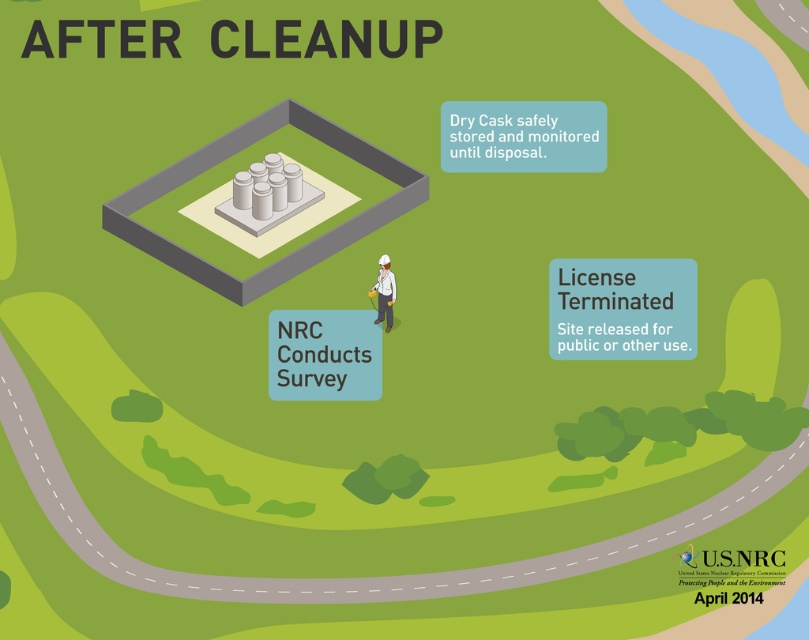
Can you confirm if matte gray cylinders at center is thinner than white hard hat at center?

No.

Find the location of a particular element. Image resolution: width=809 pixels, height=640 pixels. matte gray cylinders at center is located at coordinates (x=284, y=253).

Who is more distant from viewer, (x=217, y=161) or (x=375, y=316)?

The point (x=217, y=161) is more distant.

This screenshot has width=809, height=640. I want to click on matte gray cylinders at center, so click(284, 253).